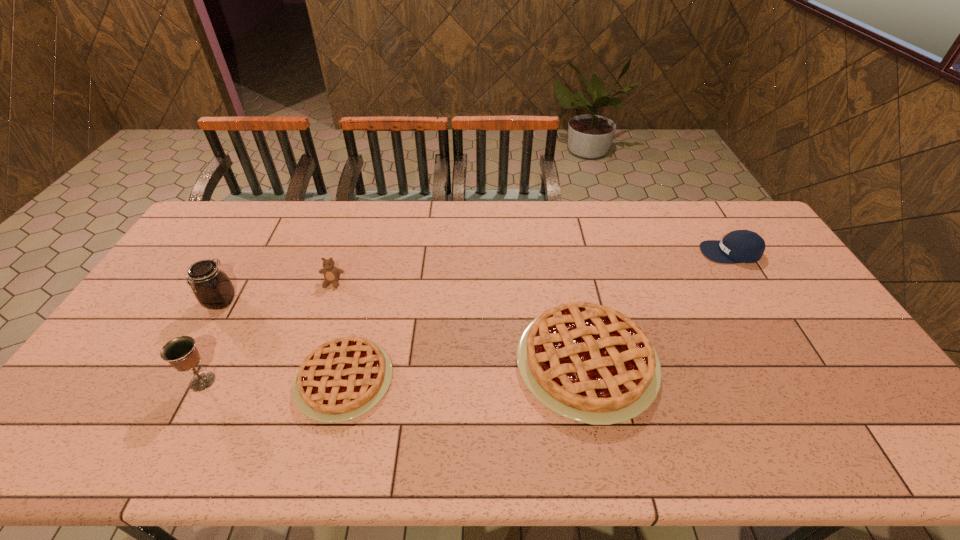
At what (x,y) coordinates should I click in order to perform the action: click on free space between the jar and the teddy bear. Please return your answer as a coordinate pair (x, y). This screenshot has height=540, width=960. Looking at the image, I should click on (276, 292).

Where is `object that ranks as the fifth closest to the baseball cap`? The height and width of the screenshot is (540, 960). object that ranks as the fifth closest to the baseball cap is located at coordinates (213, 289).

Select which object is the second closest to the baseball cap. Please provide its 2D coordinates. Your answer should be formatted as a tuple, i.e. [(x, y)], where the tuple contains the x and y coordinates of a point satisfying the conditions above.

[(342, 379)]

I want to click on vacant region that satisfies the following two spatial constraints: 1. on the front-facing side of the rightmost object; 2. on the lid of the jar, so click(x=761, y=302).

You are a GUI agent. You are given a task and a screenshot of the screen. Output one action in this format:
    pyautogui.click(x=<x>, y=<y>)
    Task: Click on the vacant space that satisfies the following two spatial constraints: 1. on the lid of the shortest object; 2. on the left side of the jar
    This screenshot has height=540, width=960.
    Given the screenshot: What is the action you would take?
    pyautogui.click(x=176, y=380)

This screenshot has width=960, height=540. In order to click on free space that satisfies the following two spatial constraints: 1. on the lid of the jar; 2. on the left side of the chalice in this screenshot , I will do `click(176, 381)`.